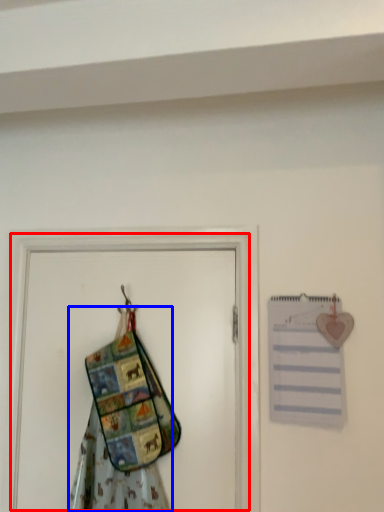
Question: Which object appears closest to the camera in this image, screen door (highlighted by a red box) or fancy dress (highlighted by a blue box)?

Choices:
 (A) screen door
 (B) fancy dress

Answer: (B)